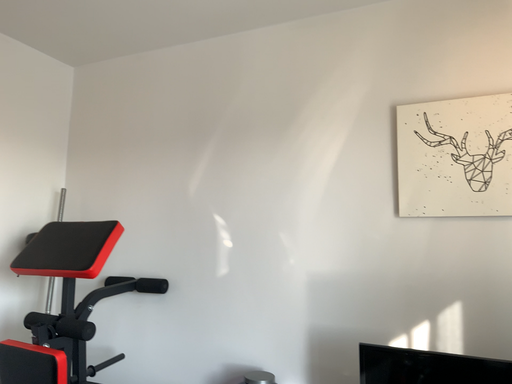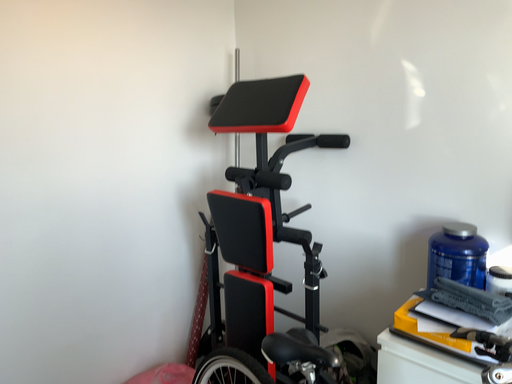
Question: Which way did the camera rotate in the video?

Choices:
 (A) rotated downward
 (B) rotated upward

Answer: (A)